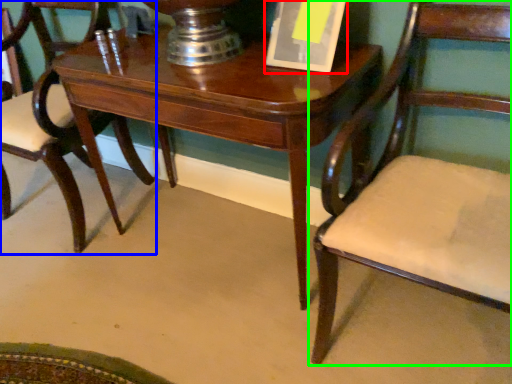
Question: Which is farther away from paperback book (highlighted by a red box)? chair (highlighted by a blue box) or chair (highlighted by a green box)?

Choices:
 (A) chair
 (B) chair

Answer: (A)